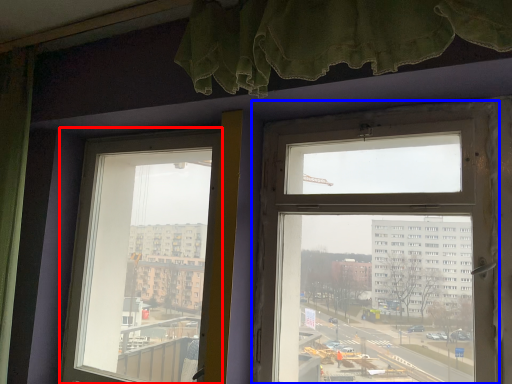
Question: Which object appears closest to the camera in this image, window (highlighted by a red box) or window (highlighted by a blue box)?

Choices:
 (A) window
 (B) window

Answer: (B)